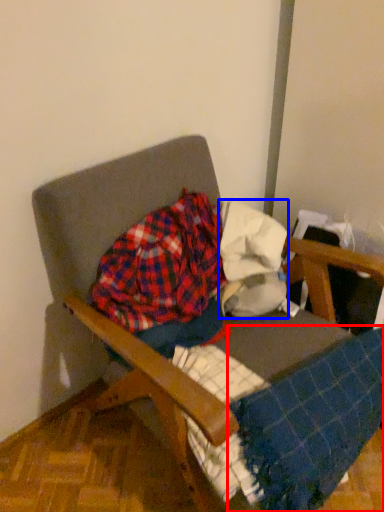
Question: Among these objects, which one is nearest to the camera, blanket (highlighted by a red box) or fabric (highlighted by a blue box)?

Choices:
 (A) blanket
 (B) fabric

Answer: (A)